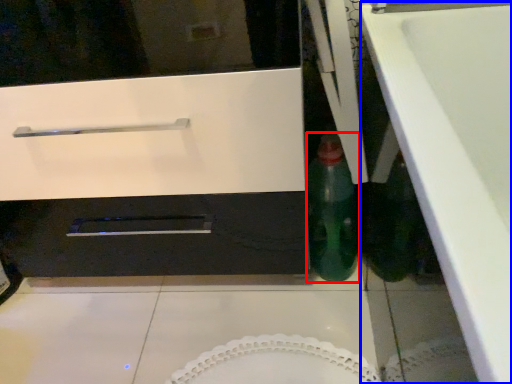
Question: Which object is further to the camera taking this photo, bottle (highlighted by a red box) or counter top (highlighted by a blue box)?

Choices:
 (A) bottle
 (B) counter top

Answer: (A)